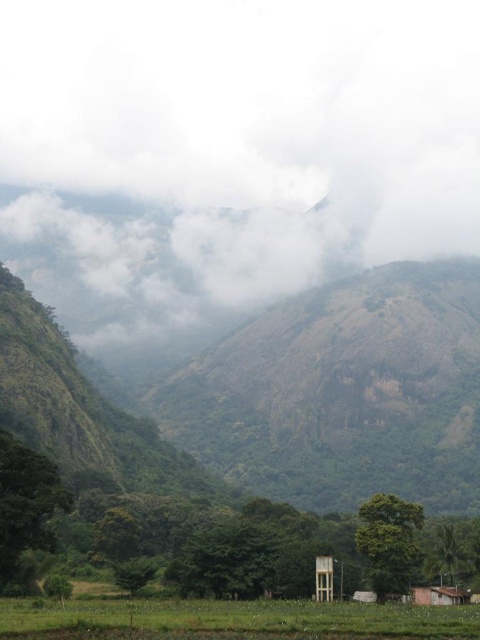
Is white fluffy cloud at upper center thinner than brown wooden hut at lower right?

No.

Does white fluffy cloud at upper center have a larger size compared to brown wooden hut at lower right?

Correct, white fluffy cloud at upper center is larger in size than brown wooden hut at lower right.

Identify the location of white fluffy cloud at upper center. (239, 141).

Between white fluffy cloud at upper center and green grassy rice field at lower center, which one has less height?

With less height is green grassy rice field at lower center.

Is white fluffy cloud at upper center shorter than green grassy rice field at lower center?

In fact, white fluffy cloud at upper center may be taller than green grassy rice field at lower center.

Find the location of a particular element. Image resolution: width=480 pixels, height=640 pixels. white fluffy cloud at upper center is located at coordinates (239, 141).

Where is `white fluffy cloud at upper center`? white fluffy cloud at upper center is located at coordinates (239, 141).

Based on the photo, can you confirm if green grassy rice field at lower center is thinner than brown wooden hut at lower right?

No.

Is green grassy rice field at lower center below brown wooden hut at lower right?

Incorrect, green grassy rice field at lower center is not positioned below brown wooden hut at lower right.

Is point (144, 620) closer to viewer compared to point (459, 595)?

That is True.

Identify the location of green grassy rice field at lower center. (233, 620).